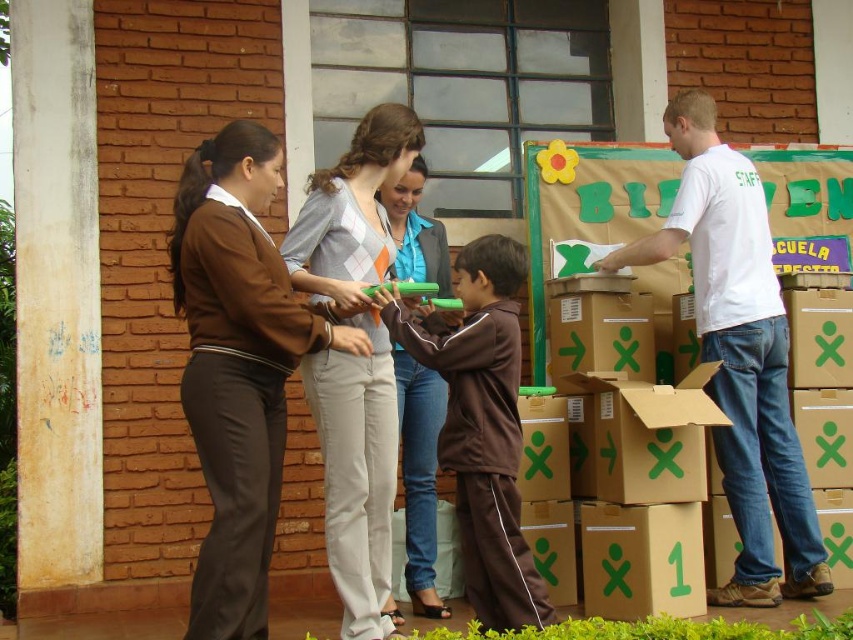
Question: From the image, what is the correct spatial relationship of brown fabric sweater at upper left in relation to light gray wool sweater at center?

Choices:
 (A) right
 (B) left

Answer: (A)

Question: Is brown fabric sweater at upper left below white cotton t-shirt at right?

Choices:
 (A) no
 (B) yes

Answer: (B)

Question: Can you confirm if white cotton t-shirt at right is bigger than light gray cotton pants at center?

Choices:
 (A) yes
 (B) no

Answer: (A)

Question: Which point appears closest to the camera in this image?

Choices:
 (A) (401, 150)
 (B) (755, 358)
 (C) (450, 440)

Answer: (C)

Question: Among these objects, which one is farthest from the camera?

Choices:
 (A) light gray cotton pants at center
 (B) light gray wool sweater at center
 (C) white cotton t-shirt at right
 (D) brown fabric sweater at upper left

Answer: (B)

Question: Among these objects, which one is farthest from the camera?

Choices:
 (A) brown fabric sweater at upper left
 (B) light gray wool sweater at center

Answer: (B)